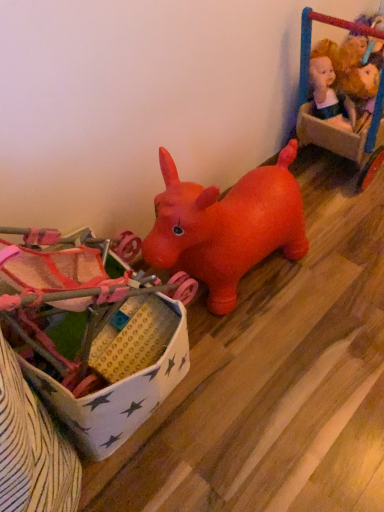
Question: Based on their sizes in the image, would you say matte plastic toy at center, which is the 1th toy from bottom to top, is bigger or smaller than plush yellow doll at upper right, which is the 2th toy from top to bottom?

Choices:
 (A) small
 (B) big

Answer: (B)

Question: From their relative heights in the image, would you say matte plastic toy at center, marked as the first toy in a left-to-right arrangement, is taller or shorter than plush yellow doll at upper right, positioned as the 2th toy in left-to-right order?

Choices:
 (A) short
 (B) tall

Answer: (B)

Question: Estimate the real-world distances between objects in this image. Which object is closer to the matte plastic toy at center, the 3th toy when ordered from top to bottom?

Choices:
 (A) plush yellow doll at upper right, which ranks as the 2th toy in right-to-left order
 (B) velvet plush doll at upper right, acting as the 1th toy starting from the right

Answer: (B)

Question: Which is nearer to the plush yellow doll at upper right, positioned as the 2th toy in left-to-right order?

Choices:
 (A) matte plastic toy at center, marked as the first toy in a left-to-right arrangement
 (B) velvet plush doll at upper right, the 1th toy viewed from the top

Answer: (B)